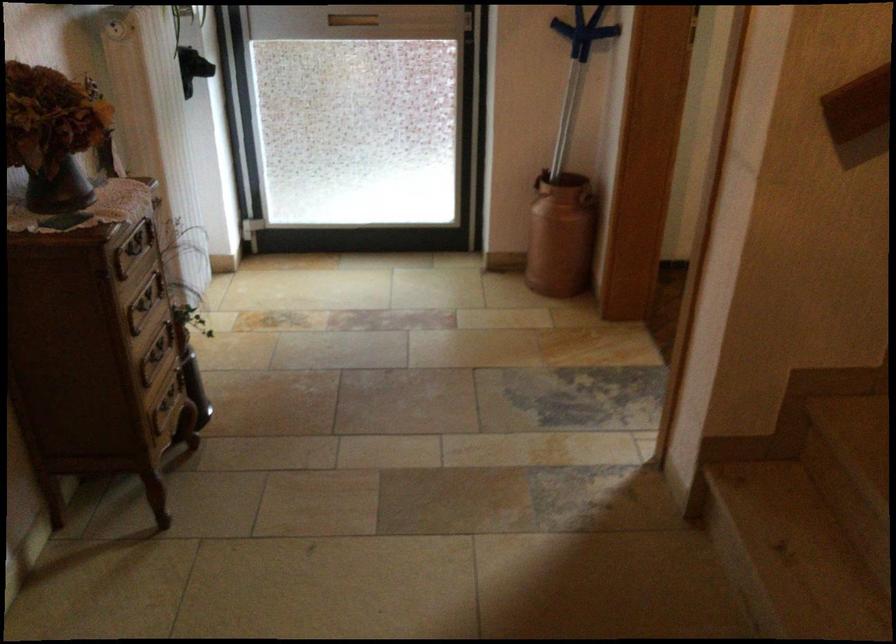
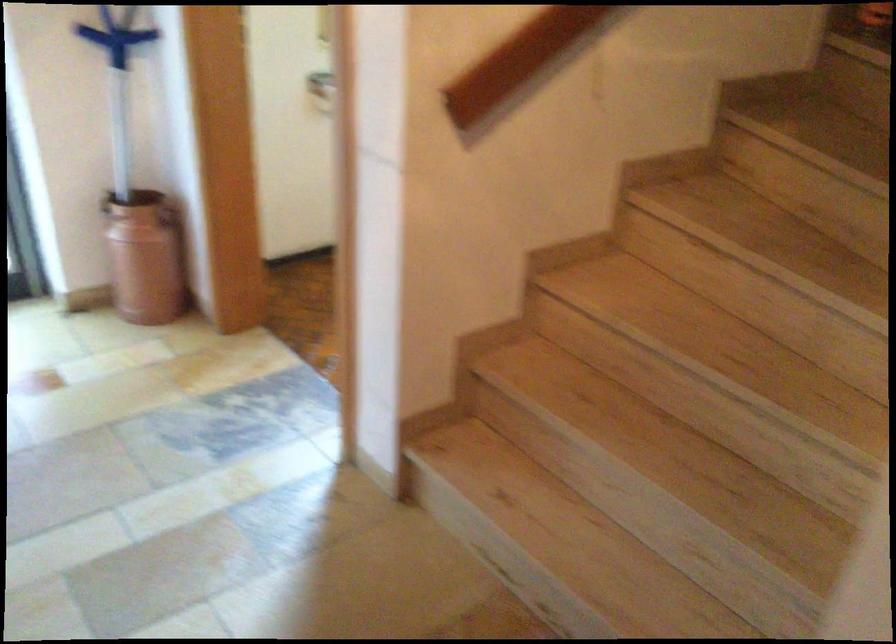
Locate, in the second image, the point that corresponds to the point at 569,71 in the first image.

(117, 82)